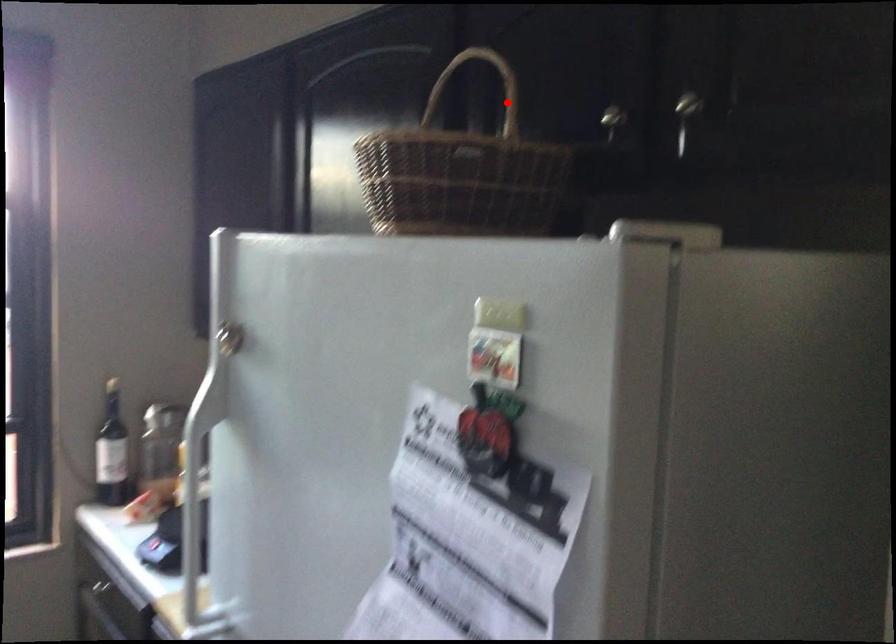
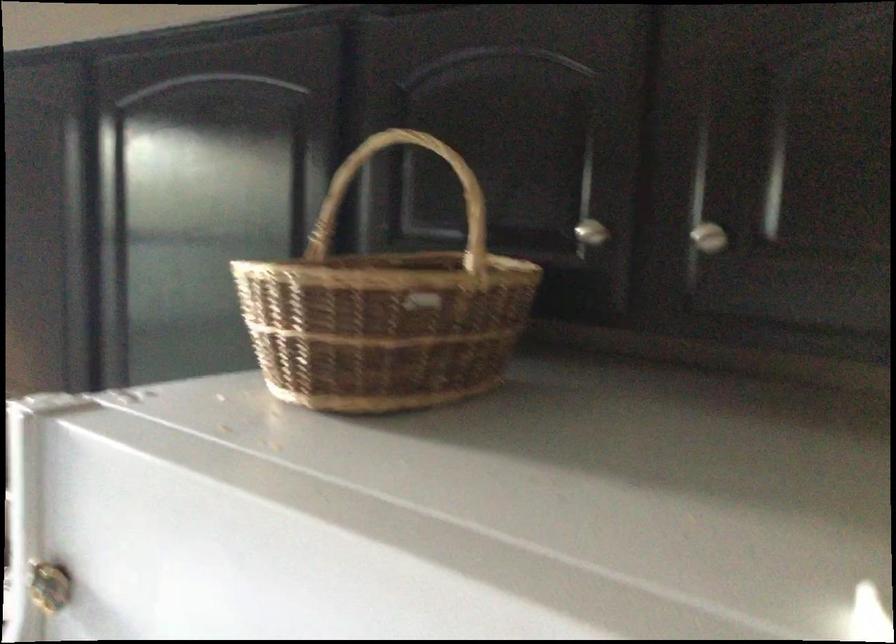
The point at the highlighted location is marked in the first image. Where is the corresponding point in the second image?

(428, 182)